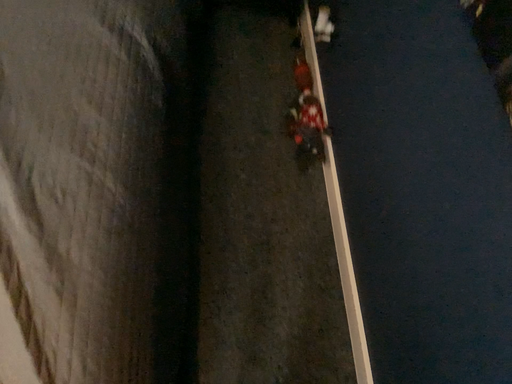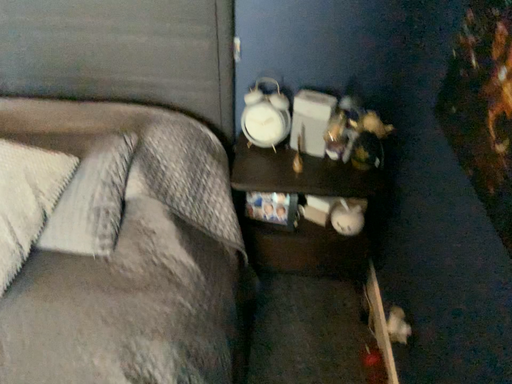
Question: How did the camera likely rotate when shooting the video?

Choices:
 (A) rotated right
 (B) rotated left

Answer: (B)